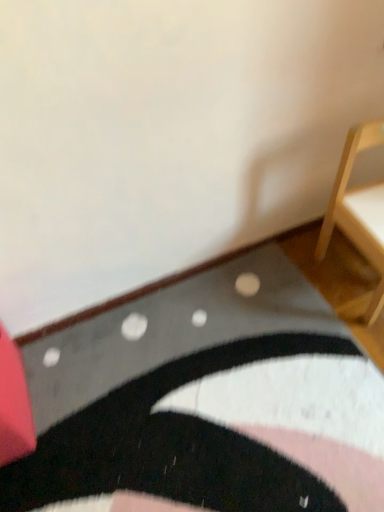
Question: Which is correct: black textured rug at lower center is inside light wood chair at right, the 2th furniture when ordered from left to right, or outside of it?

Choices:
 (A) inside
 (B) outside

Answer: (B)

Question: Does point (165, 344) appear closer or farther from the camera than point (324, 250)?

Choices:
 (A) farther
 (B) closer

Answer: (B)

Question: Estimate the real-world distances between objects in this image. Which object is farther from the light wood chair at right, which is the 1th furniture from right to left?

Choices:
 (A) rubberized red cushion at lower left, which appears as the second furniture when viewed from the right
 (B) black textured rug at lower center

Answer: (A)

Question: Considering the real-world distances, which object is closest to the light wood chair at right, the 2th furniture when ordered from left to right?

Choices:
 (A) rubberized red cushion at lower left, which appears as the second furniture when viewed from the right
 (B) black textured rug at lower center

Answer: (B)